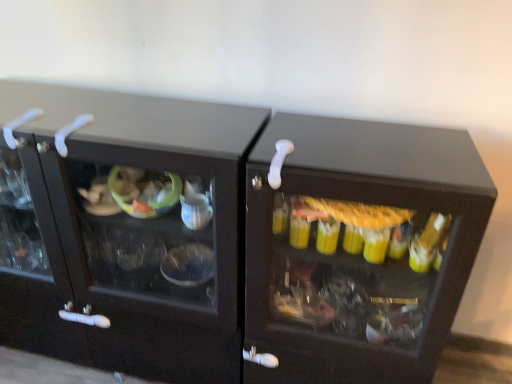
Question: Considering the relative positions of white plastic door handle at center, arranged as the first door handle when viewed from the right, and white plastic door handle at upper left, the 2th door handle positioned from the right, in the image provided, is white plastic door handle at center, arranged as the first door handle when viewed from the right, to the left or to the right of white plastic door handle at upper left, the 2th door handle positioned from the right,?

Choices:
 (A) left
 (B) right

Answer: (B)

Question: Is white plastic door handle at center, arranged as the first door handle when viewed from the right, spatially inside white plastic door handle at upper left, the 2th door handle positioned from the right, or outside of it?

Choices:
 (A) outside
 (B) inside

Answer: (A)

Question: Which of these objects is positioned farthest from the white plastic door handle at center, the 3th door handle when ordered from left to right?

Choices:
 (A) white plastic door handle at upper left, placed as the second door handle when sorted from left to right
 (B) white plastic door handle at upper left, acting as the 1th door handle starting from the left

Answer: (B)

Question: Which object is the farthest from the white plastic door handle at upper left, placed as the second door handle when sorted from left to right?

Choices:
 (A) white plastic door handle at upper left, placed as the 3th door handle when sorted from right to left
 (B) white plastic door handle at center, the 3th door handle when ordered from left to right

Answer: (B)